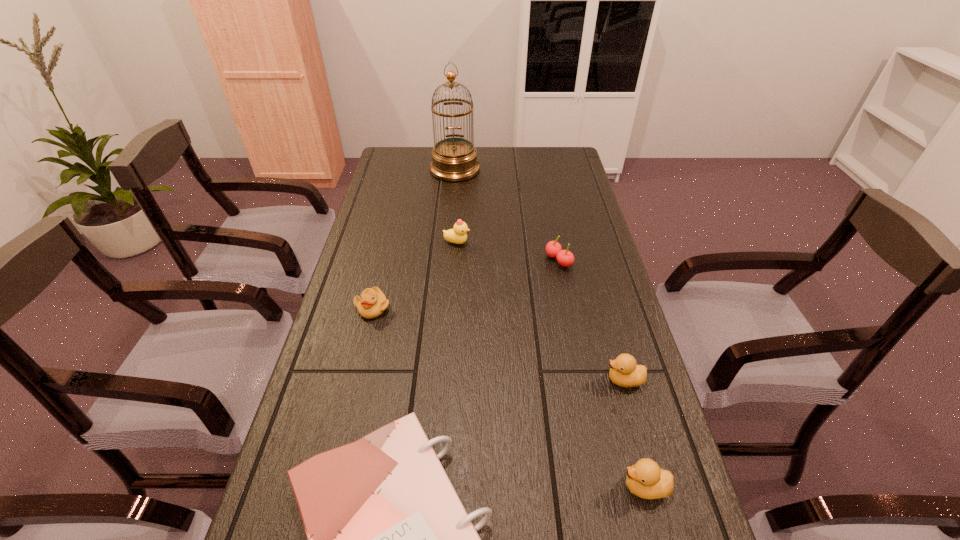
Locate an element on the screen. The width and height of the screenshot is (960, 540). free area in between the tallest object and the third farthest object is located at coordinates click(x=507, y=215).

Locate an element on the screen. free area in between the farthest object and the sixth nearest object is located at coordinates (456, 206).

Locate an element on the screen. unoccupied position between the fourth farthest object and the second farthest object is located at coordinates (415, 275).

Where is `free point between the farthest object and the nearest duckling`? This screenshot has width=960, height=540. free point between the farthest object and the nearest duckling is located at coordinates (550, 328).

Find the location of `object identified as the sixth closest to the nearest duckling`. object identified as the sixth closest to the nearest duckling is located at coordinates (453, 159).

This screenshot has height=540, width=960. I want to click on object identified as the fourth closest to the nearest duckling, so click(x=372, y=303).

You are a GUI agent. You are given a task and a screenshot of the screen. Output one action in this format:
    pyautogui.click(x=<x>, y=<y>)
    Task: Click on the duckling that can be found as the closest to the leftmost duckling
    The image size is (960, 540).
    Given the screenshot: What is the action you would take?
    pyautogui.click(x=458, y=235)

Identify which duckling is located as the third nearest to the sixth nearest object. Please provide its 2D coordinates. Your answer should be formatted as a tuple, i.e. [(x, y)], where the tuple contains the x and y coordinates of a point satisfying the conditions above.

[(645, 479)]

Locate an element on the screen. free space that satisfies the following two spatial constraints: 1. on the back side of the cherry; 2. on the front-facing side of the second duckling from left to right is located at coordinates (555, 242).

The height and width of the screenshot is (540, 960). Find the location of `vacant point that satisfies the following two spatial constraints: 1. with an open door on the farthest object; 2. on the right side of the cherry`. vacant point that satisfies the following two spatial constraints: 1. with an open door on the farthest object; 2. on the right side of the cherry is located at coordinates (447, 260).